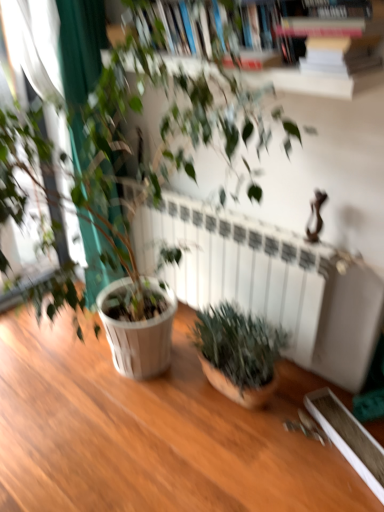
Find the location of `blank space to the left of green matte plant at lower right, the second houseplant from the top`. blank space to the left of green matte plant at lower right, the second houseplant from the top is located at coordinates (160, 398).